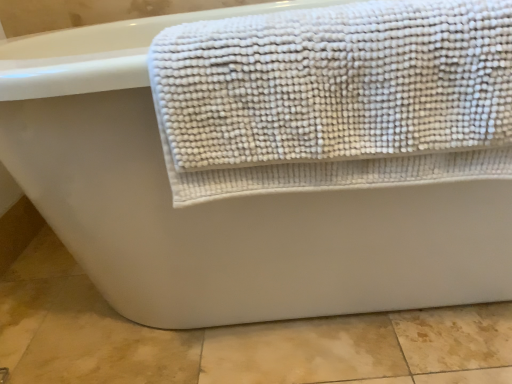
Find the location of `free area below white textured towel at upper right (from a real-world perspective)`. free area below white textured towel at upper right (from a real-world perspective) is located at coordinates (357, 349).